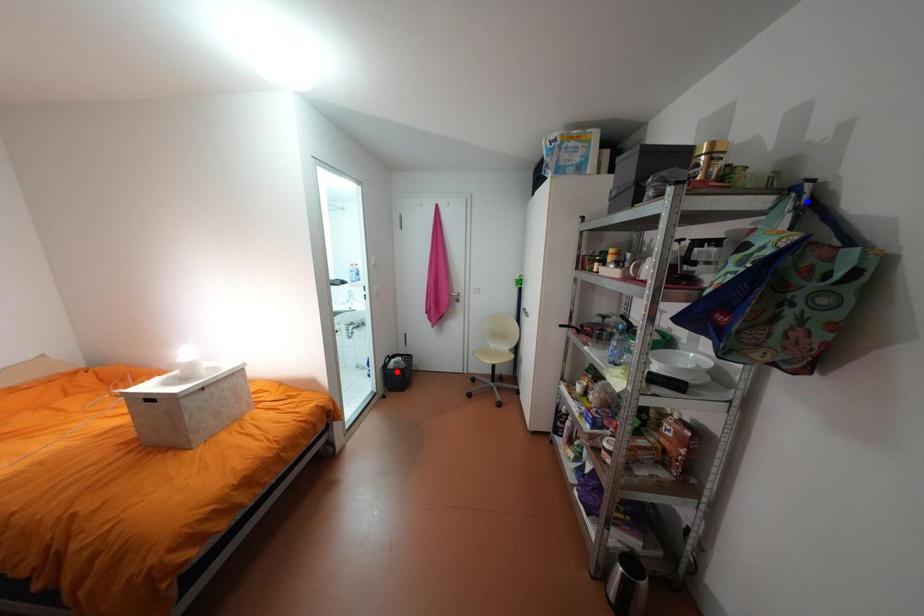
Question: Two points are marked on the image. Which point is closer to the camera?

Choices:
 (A) Blue point is closer.
 (B) Red point is closer.

Answer: (A)